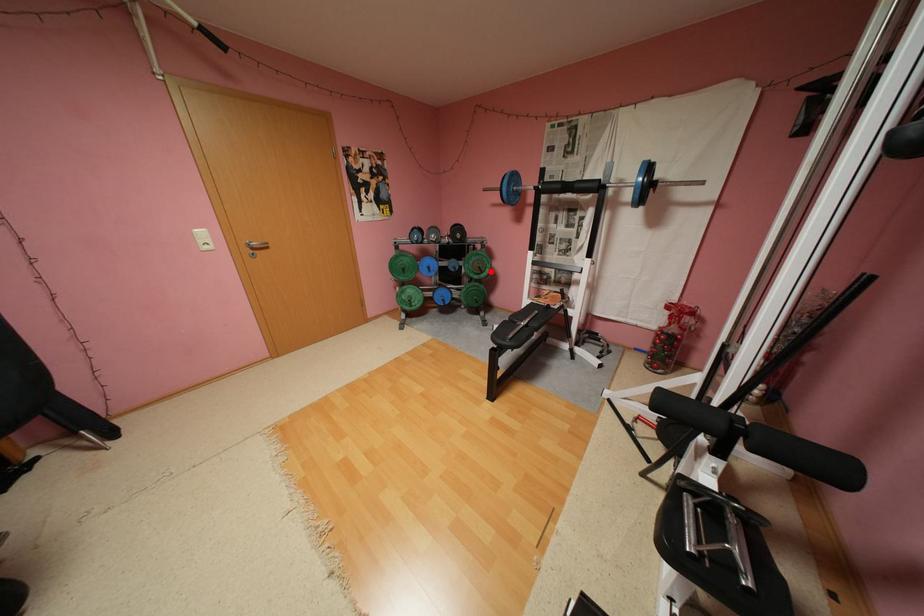
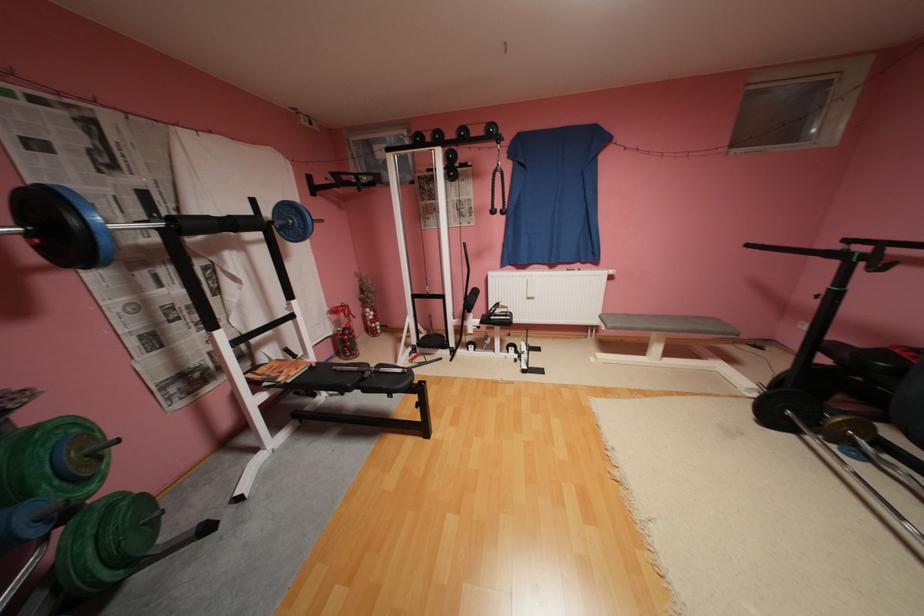
Question: I am providing you with two images of the same scene from different viewpoints. Given a red point in image1, look at the same physical point in image2. Is it:

Choices:
 (A) Closer to the viewpoint
 (B) Farther from the viewpoint

Answer: (B)